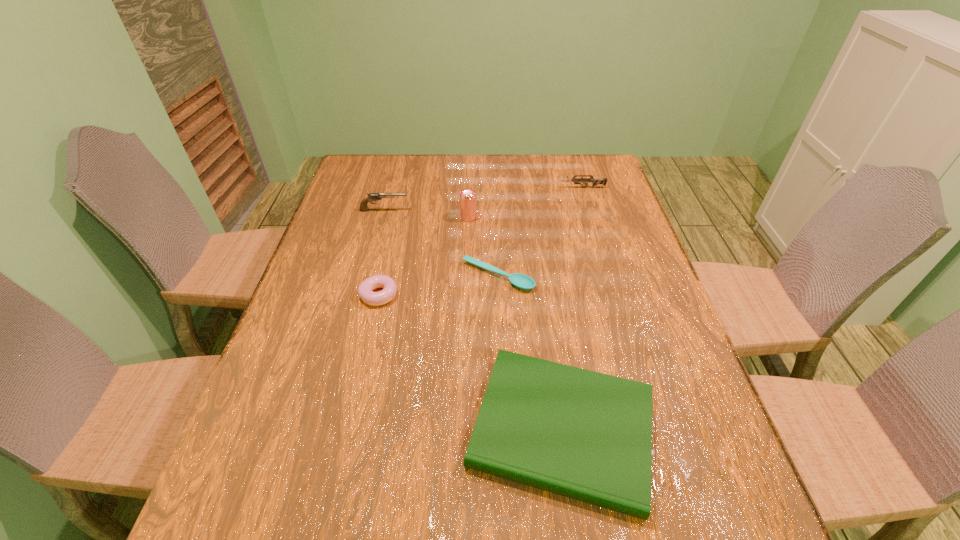
Where is `the third farthest object`? the third farthest object is located at coordinates (467, 196).

Identify the location of the tallest object. (467, 196).

You are a GUI agent. You are given a task and a screenshot of the screen. Output one action in this format:
    pyautogui.click(x=<x>, y=<y>)
    Task: Click on the second farthest object
    This screenshot has width=960, height=540.
    Given the screenshot: What is the action you would take?
    pyautogui.click(x=371, y=197)

Where is `the nearer gun`? This screenshot has height=540, width=960. the nearer gun is located at coordinates (371, 197).

What are the coordinates of `the farther gun` in the screenshot? It's located at (595, 181).

Locate an element on the screen. The height and width of the screenshot is (540, 960). the right gun is located at coordinates [x=595, y=181].

Where is `doughnut`? The height and width of the screenshot is (540, 960). doughnut is located at coordinates (365, 290).

This screenshot has width=960, height=540. I want to click on paperback book, so click(585, 435).

I want to click on the shortest object, so click(521, 281).

Locate an element on the screen. free space located on the back of the tallest object is located at coordinates (469, 177).